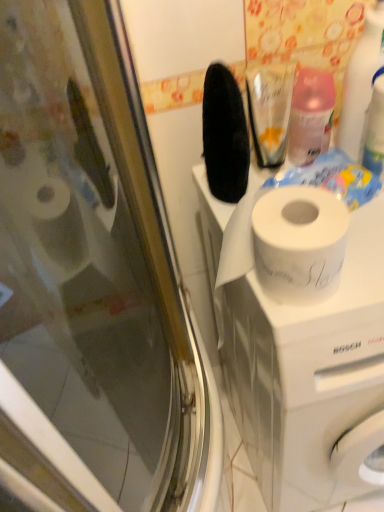
Question: From a real-world perspective, is white matte washing machine at upper center located beneath translucent plastic spray bottle at upper right, acting as the 1th cleaning product starting from the left?

Choices:
 (A) no
 (B) yes

Answer: (B)

Question: From a real-world perspective, is white matte washing machine at upper center on top of translucent plastic spray bottle at upper right, marked as the second cleaning product in a right-to-left arrangement?

Choices:
 (A) no
 (B) yes

Answer: (A)

Question: Considering the relative sizes of white matte washing machine at upper center and translucent plastic spray bottle at upper right, marked as the second cleaning product in a right-to-left arrangement, in the image provided, is white matte washing machine at upper center wider than translucent plastic spray bottle at upper right, marked as the second cleaning product in a right-to-left arrangement,?

Choices:
 (A) no
 (B) yes

Answer: (B)

Question: Is white matte washing machine at upper center thinner than translucent plastic spray bottle at upper right, acting as the 1th cleaning product starting from the left?

Choices:
 (A) yes
 (B) no

Answer: (B)

Question: From the image's perspective, is white matte washing machine at upper center beneath translucent plastic spray bottle at upper right, marked as the second cleaning product in a right-to-left arrangement?

Choices:
 (A) no
 (B) yes

Answer: (B)

Question: From the image's perspective, is translucent plastic spray bottle at upper right, marked as the second cleaning product in a right-to-left arrangement, above or below white glossy spray bottle at upper right, the second cleaning product positioned from the left?

Choices:
 (A) above
 (B) below

Answer: (B)

Question: Considering the positions of translucent plastic spray bottle at upper right, marked as the second cleaning product in a right-to-left arrangement, and white glossy spray bottle at upper right, the second cleaning product positioned from the left, in the image, is translucent plastic spray bottle at upper right, marked as the second cleaning product in a right-to-left arrangement, taller or shorter than white glossy spray bottle at upper right, the second cleaning product positioned from the left,?

Choices:
 (A) short
 (B) tall

Answer: (A)

Question: Do you think translucent plastic spray bottle at upper right, marked as the second cleaning product in a right-to-left arrangement, is within white glossy spray bottle at upper right, positioned as the 1th cleaning product in right-to-left order, or outside of it?

Choices:
 (A) inside
 (B) outside

Answer: (B)

Question: Considering the relative positions of translucent plastic spray bottle at upper right, acting as the 1th cleaning product starting from the left, and white glossy spray bottle at upper right, positioned as the 1th cleaning product in right-to-left order, in the image provided, is translucent plastic spray bottle at upper right, acting as the 1th cleaning product starting from the left, to the left or to the right of white glossy spray bottle at upper right, positioned as the 1th cleaning product in right-to-left order,?

Choices:
 (A) left
 (B) right

Answer: (A)

Question: Relative to white matte washing machine at upper center, is translucent plastic spray bottle at upper right, acting as the 1th cleaning product starting from the left, in front or behind?

Choices:
 (A) front
 (B) behind

Answer: (B)

Question: From the image's perspective, is translucent plastic spray bottle at upper right, acting as the 1th cleaning product starting from the left, positioned above or below white matte washing machine at upper center?

Choices:
 (A) below
 (B) above

Answer: (B)

Question: Is point (311, 126) closer or farther from the camera than point (316, 503)?

Choices:
 (A) closer
 (B) farther

Answer: (A)

Question: Is translucent plastic spray bottle at upper right, acting as the 1th cleaning product starting from the left, spatially inside white matte washing machine at upper center, or outside of it?

Choices:
 (A) outside
 (B) inside

Answer: (A)

Question: From a real-world perspective, is white matte washing machine at upper center above or below translucent plastic spray bottle at upper right, acting as the 1th cleaning product starting from the left?

Choices:
 (A) below
 (B) above

Answer: (A)

Question: Is white matte washing machine at upper center in front of or behind translucent plastic spray bottle at upper right, acting as the 1th cleaning product starting from the left, in the image?

Choices:
 (A) front
 (B) behind

Answer: (A)